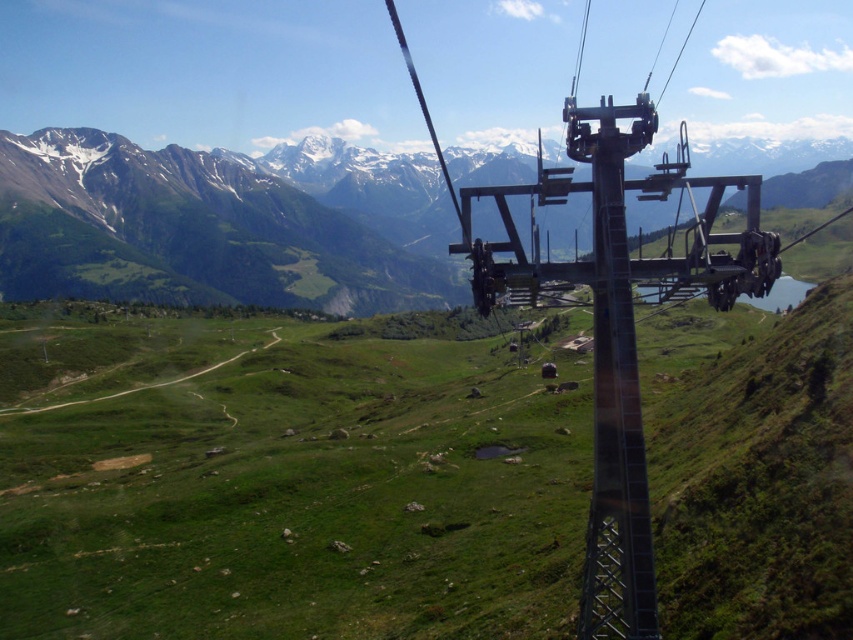
In the scene shown: Can you confirm if snowy granite mountain range at upper center is positioned below metallic gray pole at center?

No, snowy granite mountain range at upper center is not below metallic gray pole at center.

Between snowy granite mountain range at upper center and metallic gray pole at center, which one has more height?

snowy granite mountain range at upper center

Does point (236, 282) come behind point (590, 208)?

No, (236, 282) is closer to viewer.

Locate an element on the screen. Image resolution: width=853 pixels, height=640 pixels. snowy granite mountain range at upper center is located at coordinates (222, 225).

Does metallic gray ski lift at center have a larger size compared to metallic gray pole at center?

Indeed, metallic gray ski lift at center has a larger size compared to metallic gray pole at center.

Describe the element at coordinates (613, 323) in the screenshot. I see `metallic gray ski lift at center` at that location.

Where is `metallic gray ski lift at center`? metallic gray ski lift at center is located at coordinates (613, 323).

Consider the image. Can you confirm if snowy granite mountain range at upper center is smaller than metallic gray ski lift at center?

No, snowy granite mountain range at upper center is not smaller than metallic gray ski lift at center.

The height and width of the screenshot is (640, 853). Describe the element at coordinates (222, 225) in the screenshot. I see `snowy granite mountain range at upper center` at that location.

Is point (318, 252) in front of point (523, 253)?

No, (318, 252) is further to viewer.

The image size is (853, 640). Identify the location of snowy granite mountain range at upper center. (222, 225).